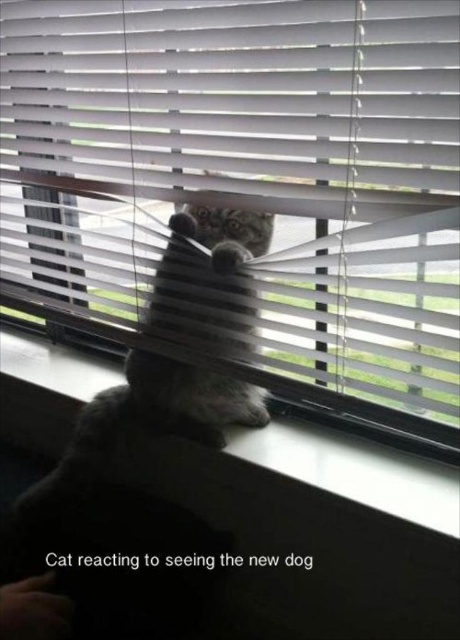
Question: Observing the image, what is the correct spatial positioning of white plastic blinds at center in reference to gray fluffy cat at center?

Choices:
 (A) left
 (B) right

Answer: (B)

Question: Can you confirm if white plastic blinds at center is thinner than gray fluffy cat at center?

Choices:
 (A) no
 (B) yes

Answer: (A)

Question: From the image, what is the correct spatial relationship of white plastic blinds at center in relation to gray fluffy cat at center?

Choices:
 (A) below
 (B) above

Answer: (B)

Question: Which object is closer to the camera taking this photo?

Choices:
 (A) white plastic blinds at center
 (B) white plastic window sill at center
 (C) gray fluffy cat at center

Answer: (A)

Question: Which point appears closest to the camera in this image?

Choices:
 (A) (212, 268)
 (B) (205, 324)

Answer: (A)

Question: Which object appears closest to the camera in this image?

Choices:
 (A) gray fluffy cat at center
 (B) white plastic blinds at center

Answer: (B)